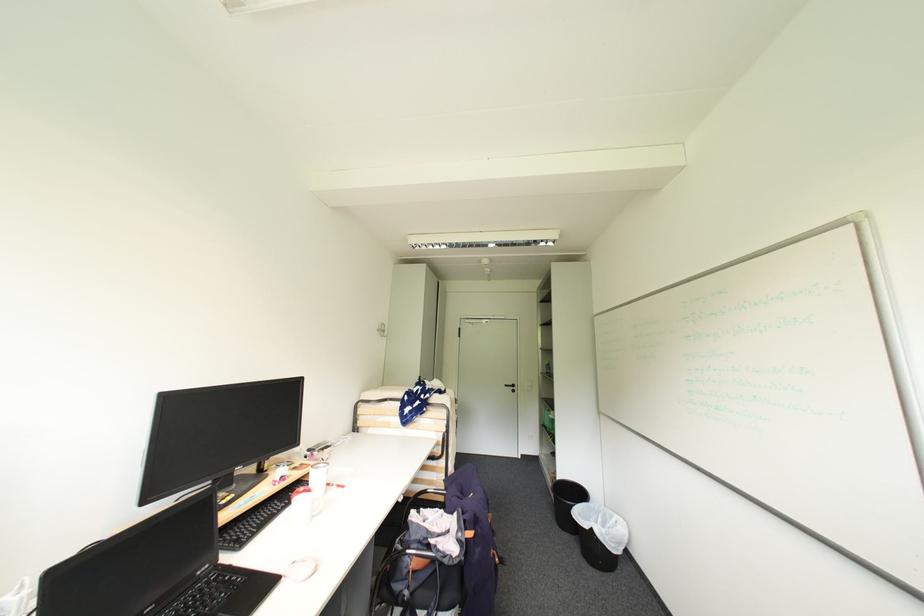
At what (x,y) coordinates should I click in order to perform the action: click on silver chair armrest. Please return your answer as a coordinate pair (x, y). This screenshot has height=616, width=924. Looking at the image, I should click on (443, 553).